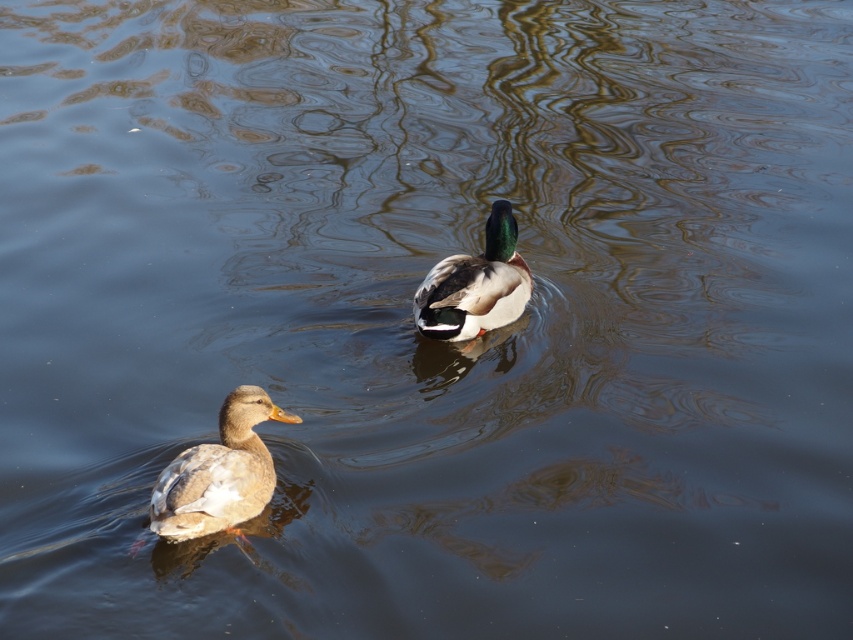
Question: Is brown feathered duck at lower left closer to the viewer compared to green glossy duck at center?

Choices:
 (A) yes
 (B) no

Answer: (A)

Question: Does brown feathered duck at lower left have a lesser width compared to green glossy duck at center?

Choices:
 (A) no
 (B) yes

Answer: (B)

Question: Where is brown feathered duck at lower left located in relation to green glossy duck at center in the image?

Choices:
 (A) below
 (B) above

Answer: (A)